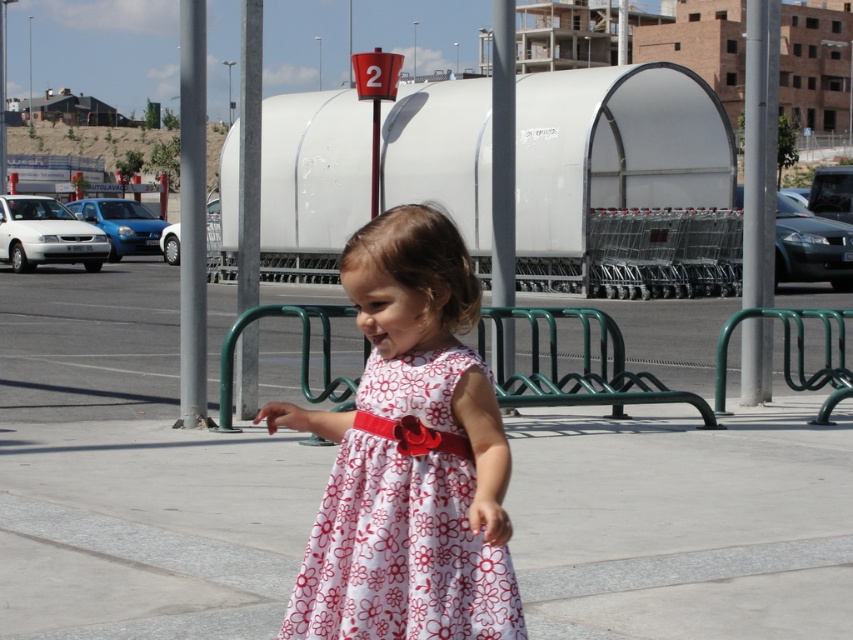
Is point (692, 380) more distant than point (361, 465)?

That is True.

Between white concrete pavement at center and floral cotton dress at center, which one appears on the right side from the viewer's perspective?

white concrete pavement at center

At what (x,y) coordinates should I click in order to perform the action: click on white concrete pavement at center. Please return your answer as a coordinate pair (x, y). Looking at the image, I should click on (132, 474).